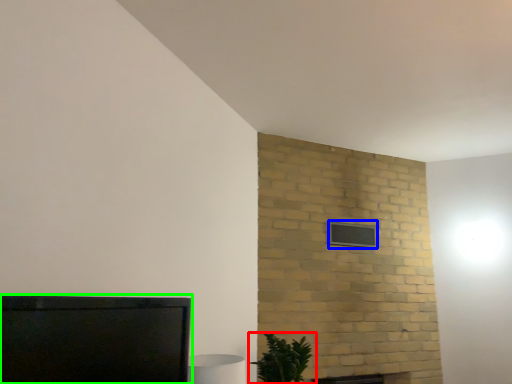
Question: Considering the real-world distances, which object is closest to houseplant (highlighted by a red box)? window (highlighted by a blue box) or furniture (highlighted by a green box).

Choices:
 (A) window
 (B) furniture

Answer: (A)